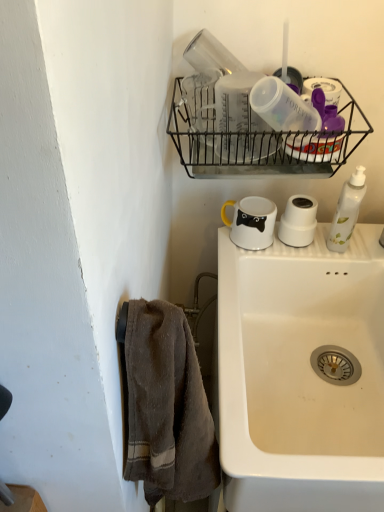
At what (x,y) coordinates should I click in order to perform the action: click on vacant point to the right of white matte toilet paper at upper center. Please return your answer as a coordinate pair (x, y). Looking at the image, I should click on (349, 242).